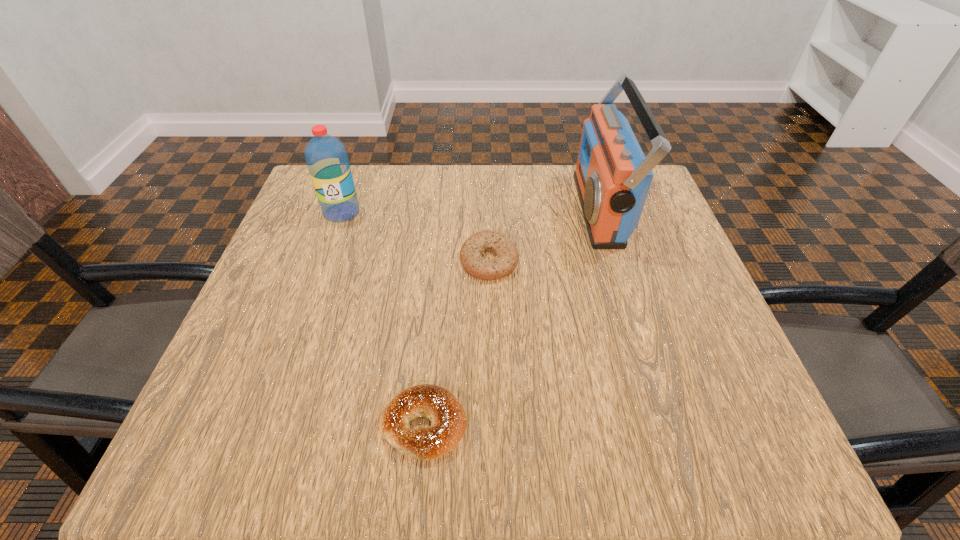
At what (x,y) coordinates should I click in order to perform the action: click on radio receiver. Please return your answer as a coordinate pair (x, y). Looking at the image, I should click on (612, 176).

I want to click on the tallest object, so click(x=612, y=176).

Identify the location of the leftmost object. The image size is (960, 540). (326, 157).

Identify the location of the third shortest object. The height and width of the screenshot is (540, 960). (326, 157).

The height and width of the screenshot is (540, 960). I want to click on the farther bagel, so click(x=472, y=250).

Image resolution: width=960 pixels, height=540 pixels. In order to click on the nearest object in this screenshot , I will do `click(434, 403)`.

I want to click on free space located 0.300m on the front-facing side of the radio receiver, so coord(456,209).

Locate an element on the screen. vacant space located on the front-facing side of the radio receiver is located at coordinates tap(545, 209).

I want to click on vacant position located on the front-facing side of the radio receiver, so click(516, 209).

Identify the location of free space located 0.380m on the front label of the second tallest object. (290, 360).